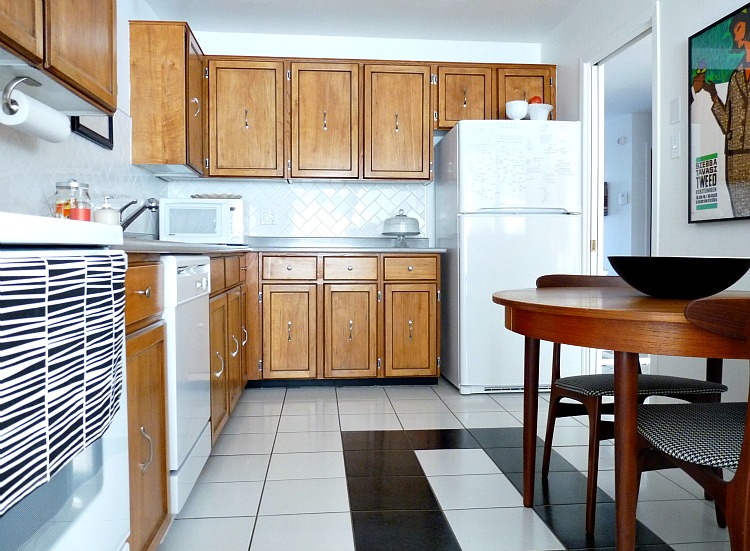
The height and width of the screenshot is (551, 750). In order to click on sink in this screenshot , I will do `click(135, 208)`.